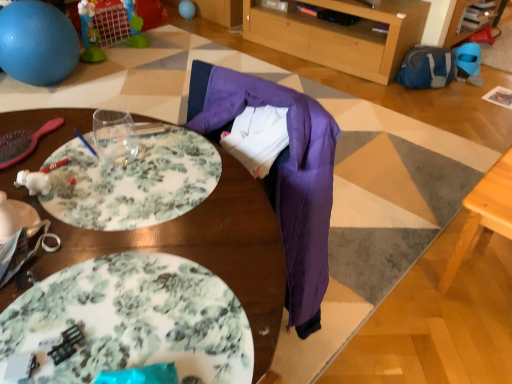
Where is `free space to the back side of white glossy plate at lower left, marked as the second plate in a bottom-to-top arrangement`? free space to the back side of white glossy plate at lower left, marked as the second plate in a bottom-to-top arrangement is located at coordinates (82, 186).